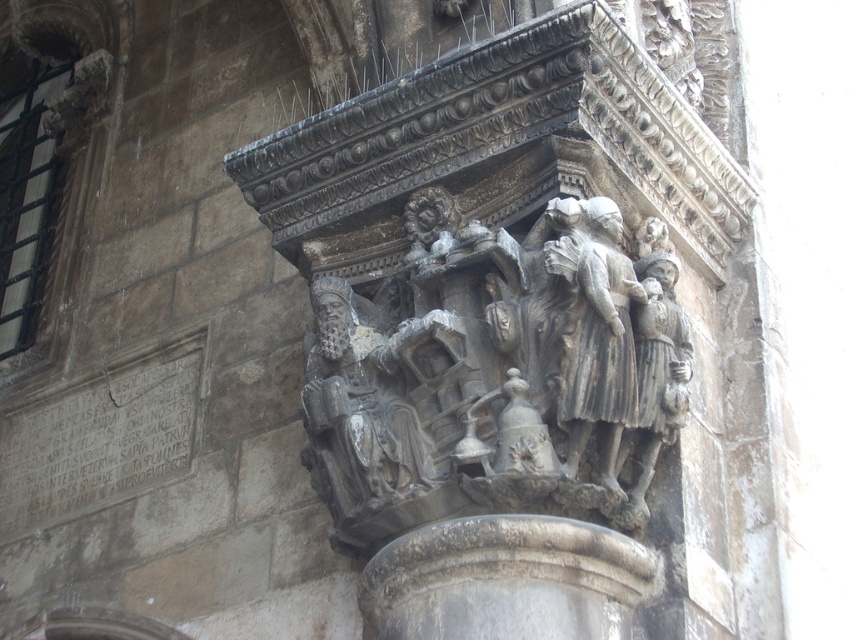
You are an architect examining the historical building details. You notice the gray stone carving at center and the gray stone figures at center. Which one is located above the other?

The gray stone carving at center is positioned over the gray stone figures at center, so the gray stone carving at center is above the gray stone figures at center.

Based on the photo, you are an architect examining a detailed stone carving in a historical building. You notice a point at coordinates (505, 326). What object is located at this specific coordinate?

The gray stone carving at center is located at point (505, 326).